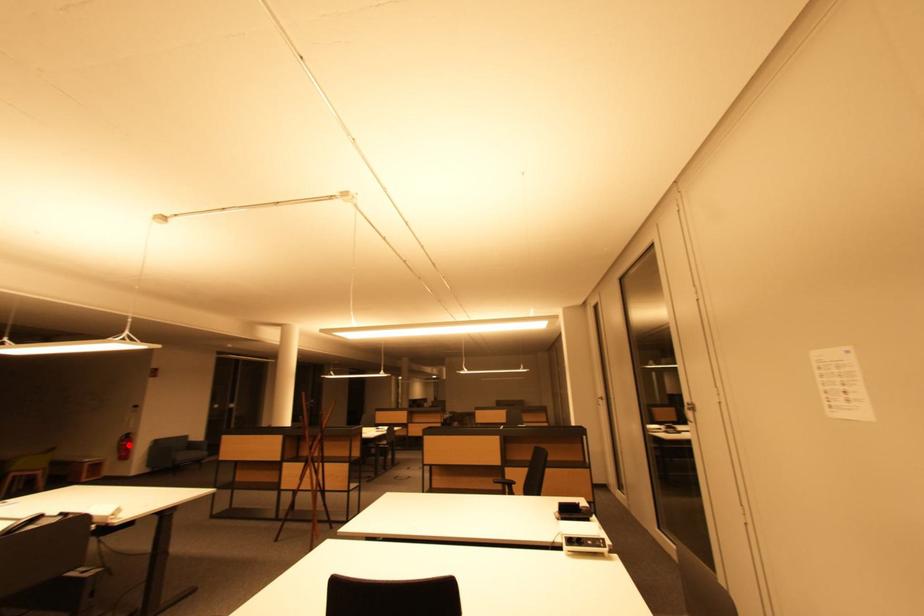
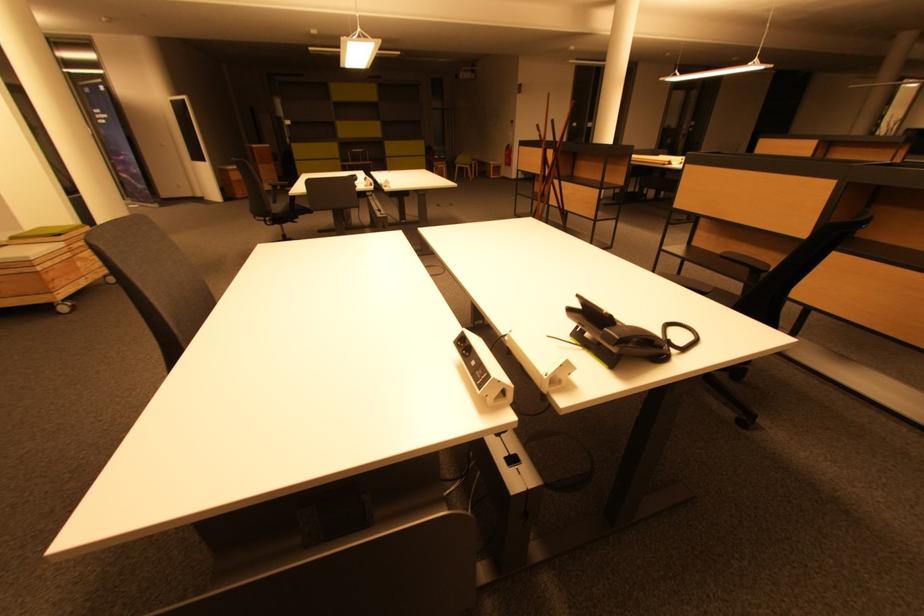
Find the pixel in the second image that matches the highlighted location in the first image.

(512, 155)